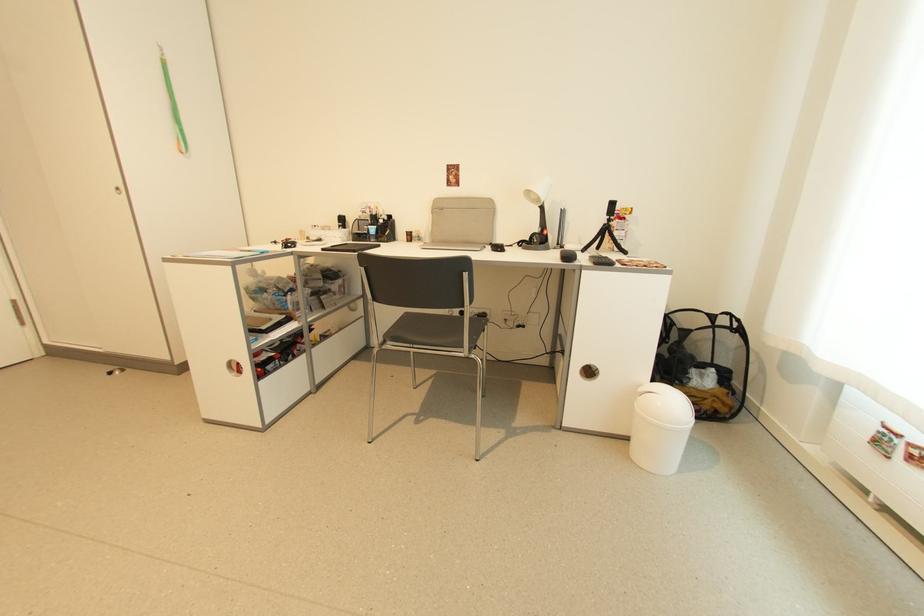
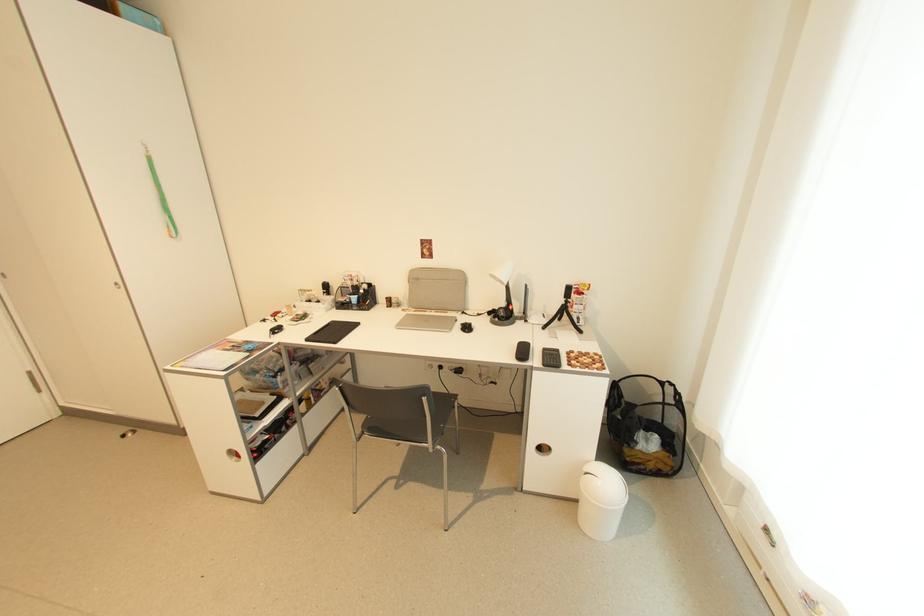
Find the pixel in the second image that matches point 614,222 in the first image.

(572, 302)